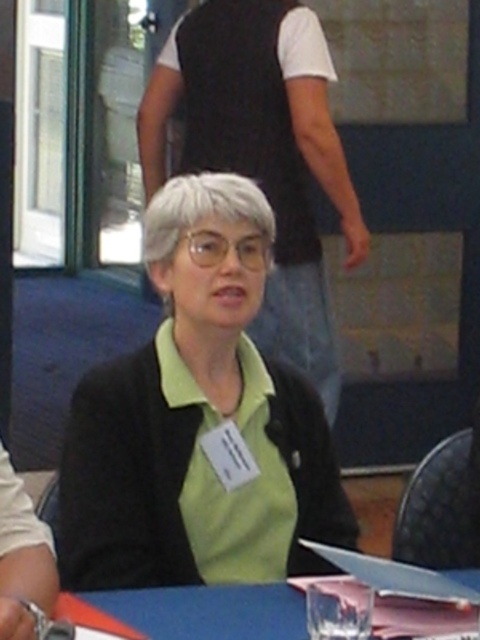
From the picture: Who is positioned more to the left, black vest at upper center or blue fabric table at lower center?

Positioned to the left is black vest at upper center.

Is black vest at upper center smaller than blue fabric table at lower center?

Incorrect, black vest at upper center is not smaller in size than blue fabric table at lower center.

I want to click on black vest at upper center, so click(x=263, y=150).

Is point (172, 522) farther from viewer compared to point (249, 52)?

No, (172, 522) is in front of (249, 52).

How much distance is there between green matte shirt at center and black vest at upper center?

The distance of green matte shirt at center from black vest at upper center is 1.48 meters.

Is point (90, 508) closer to camera compared to point (252, 33)?

Yes, it is.

Locate an element on the screen. green matte shirt at center is located at coordinates (199, 420).

Does green matte shirt at center have a smaller size compared to blue fabric table at lower center?

No, green matte shirt at center is not smaller than blue fabric table at lower center.

Is point (249, 436) less distant than point (287, 609)?

No.

The image size is (480, 640). I want to click on green matte shirt at center, so click(199, 420).